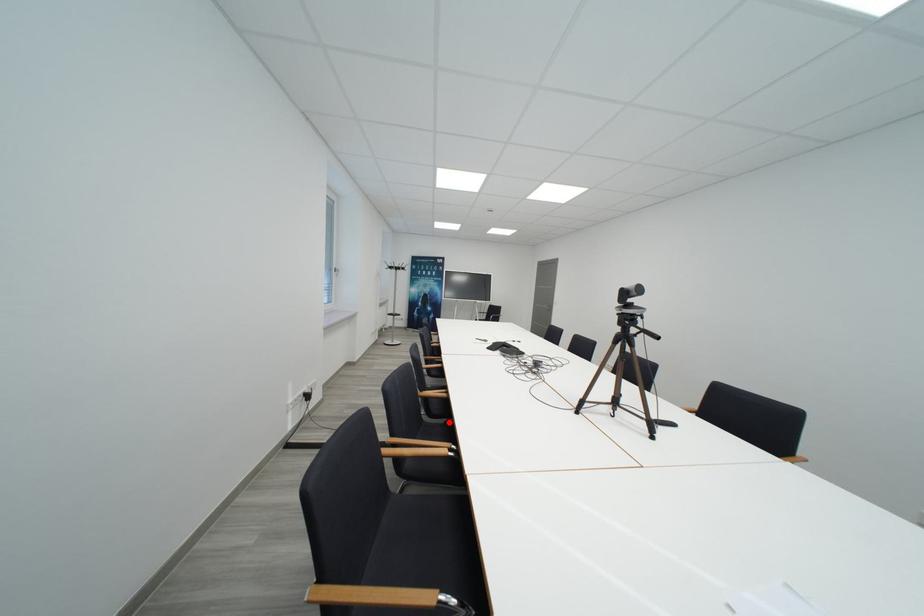
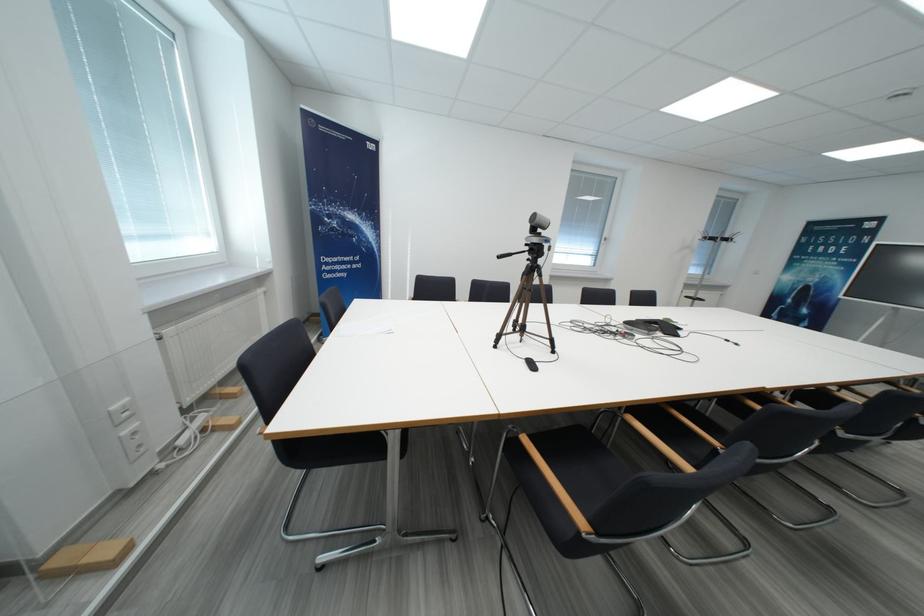
Question: I am providing you with two images of the same scene from different viewpoints. A red point is marked on the first image. At the location where the point appears in image 1, is it still visible in image 2?

Choices:
 (A) Yes
 (B) No

Answer: (B)